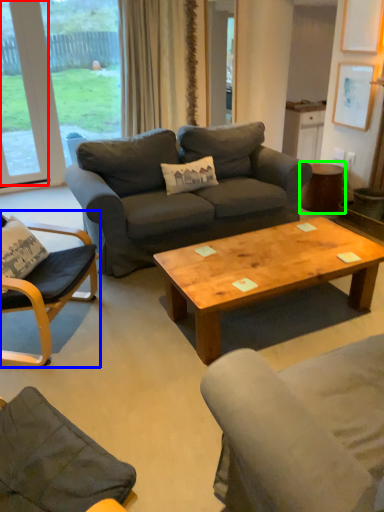
Question: Based on their relative distances, which object is nearer to window (highlighted by a red box)? Choose from chair (highlighted by a blue box) and side table (highlighted by a green box).

Choices:
 (A) chair
 (B) side table

Answer: (A)